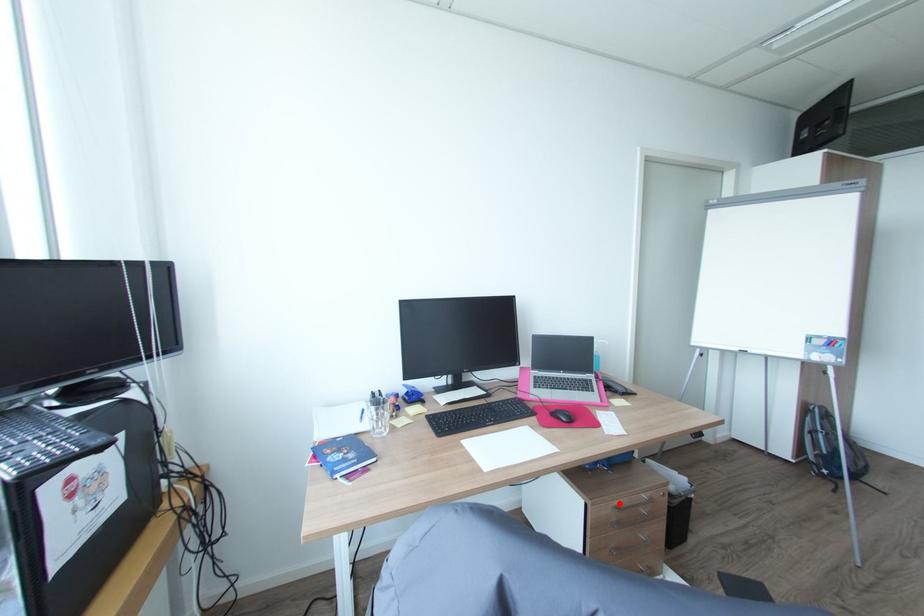
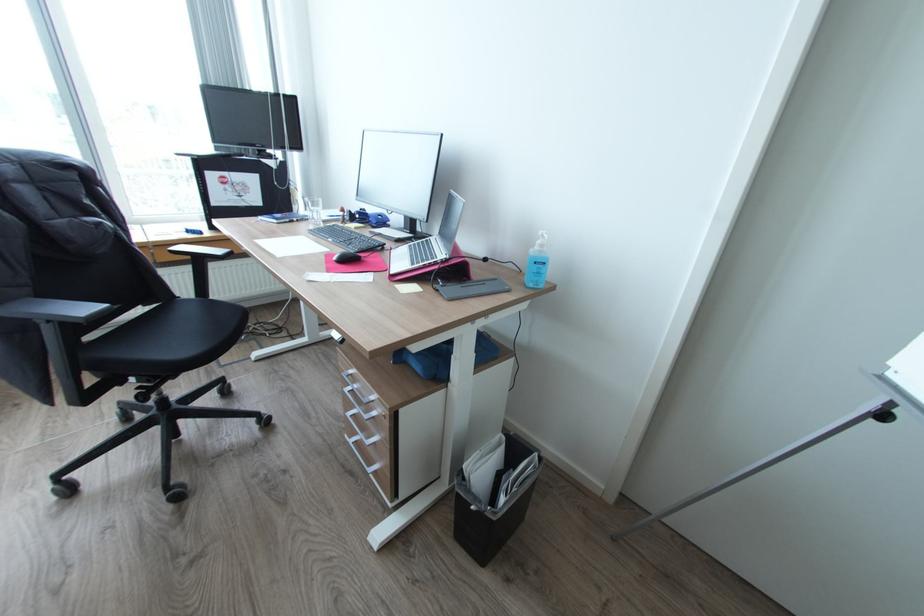
Question: I am providing you with two images of the same scene from different viewpoints. Image1 has a red point marked. In image2, the corresponding 3D location appears at what relative position? Reply with the corresponding letter.

Choices:
 (A) Closer
 (B) Farther

Answer: (B)